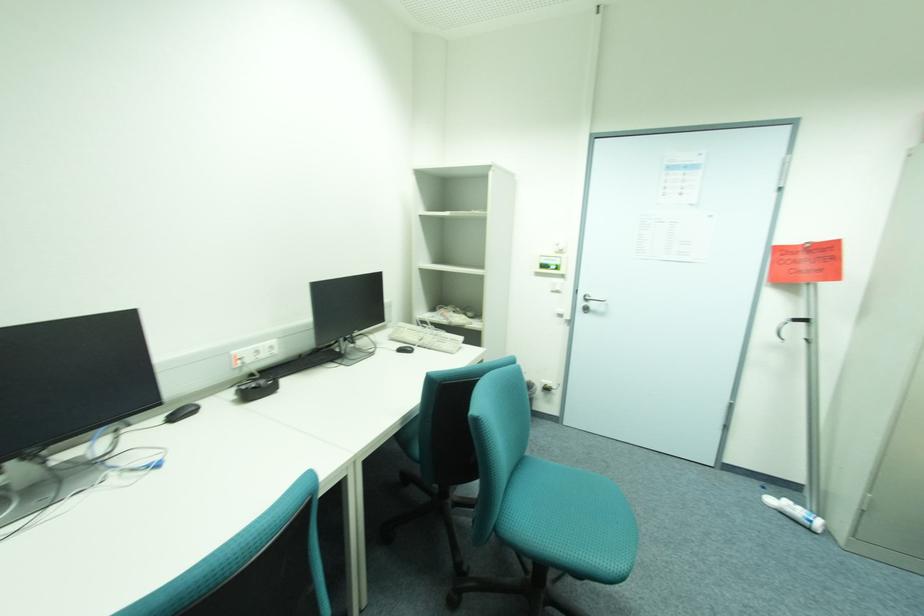
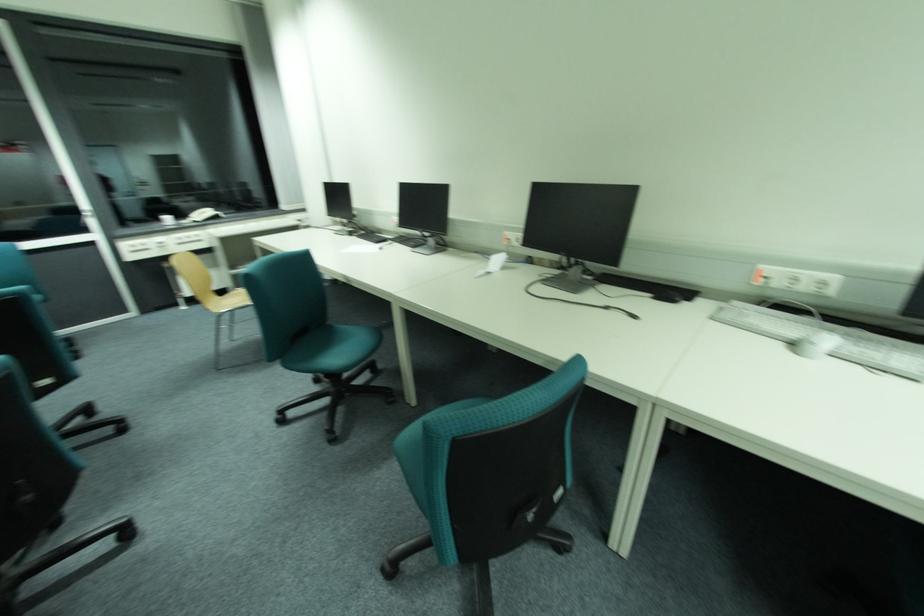
Based on the continuous images, in which direction is the camera rotating?

The rotation direction of the camera is left-down.